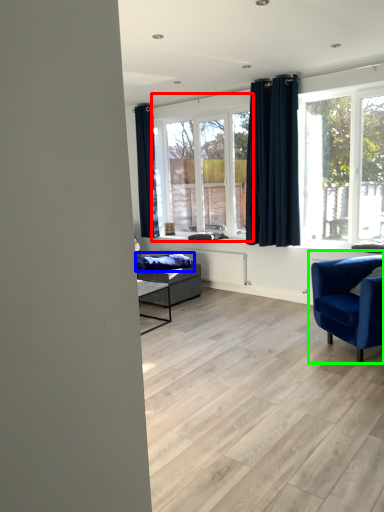
Question: Estimate the real-world distances between objects in this image. Which object is farther from window (highlighted by a red box), blanket (highlighted by a blue box) or chair (highlighted by a green box)?

Choices:
 (A) blanket
 (B) chair

Answer: (B)